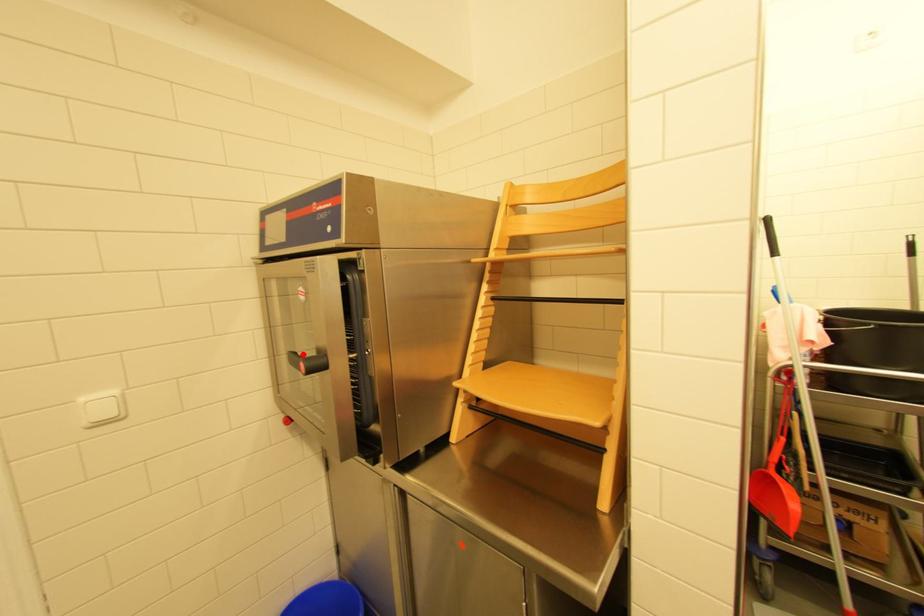
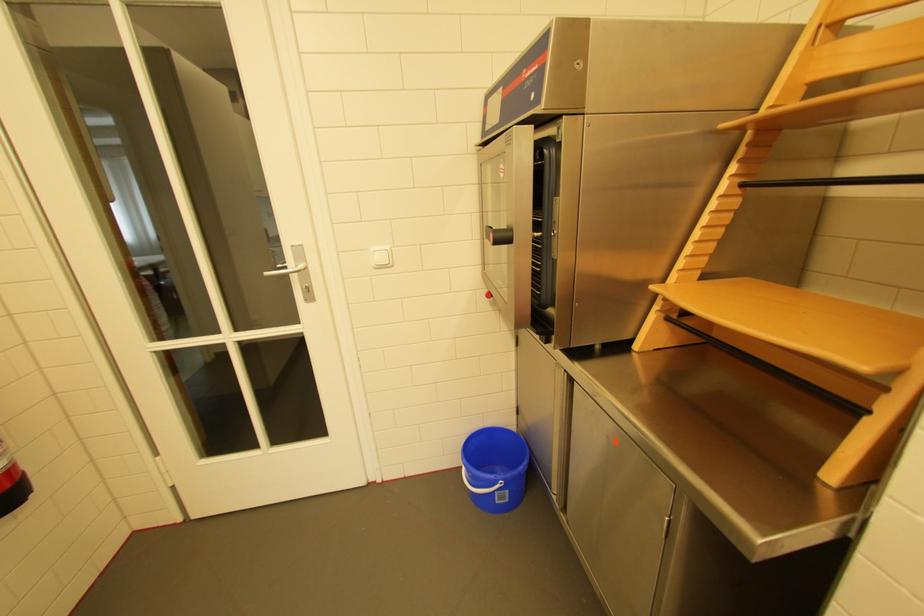
In the second image, find the point that corresponds to the highlighted location in the first image.

(499, 229)